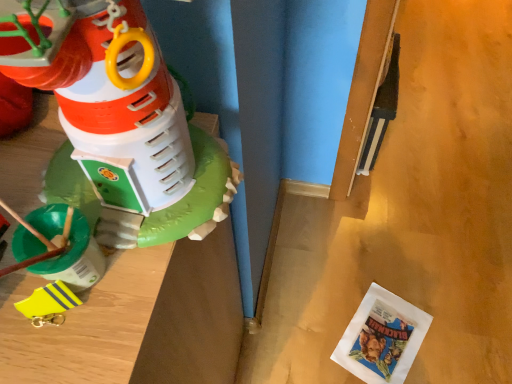
Question: Can you confirm if yellow rubber boot at left, which appears as the 1th toy when viewed from the back, is bigger than white paper comic book at lower right?

Choices:
 (A) no
 (B) yes

Answer: (A)

Question: Is yellow rubber boot at left, which appears as the 1th toy when viewed from the back, shorter than white paper comic book at lower right?

Choices:
 (A) no
 (B) yes

Answer: (A)

Question: Would you consider yellow rubber boot at left, the 2th toy when ordered from front to back, to be distant from white paper comic book at lower right?

Choices:
 (A) no
 (B) yes

Answer: (B)

Question: Considering the relative positions of yellow rubber boot at left, positioned as the second toy in top-to-bottom order, and white paper comic book at lower right in the image provided, is yellow rubber boot at left, positioned as the second toy in top-to-bottom order, behind white paper comic book at lower right?

Choices:
 (A) no
 (B) yes

Answer: (A)

Question: Is yellow rubber boot at left, which appears as the 1th toy when viewed from the back, looking in the opposite direction of white paper comic book at lower right?

Choices:
 (A) no
 (B) yes

Answer: (A)

Question: Is point (424, 312) positioned closer to the camera than point (58, 319)?

Choices:
 (A) closer
 (B) farther

Answer: (B)

Question: In the image, is white paper comic book at lower right positioned in front of or behind yellow rubber boot at left, marked as the 1th toy in a bottom-to-top arrangement?

Choices:
 (A) front
 (B) behind

Answer: (B)

Question: Considering the positions of white paper comic book at lower right and yellow rubber boot at left, marked as the 1th toy in a bottom-to-top arrangement, in the image, is white paper comic book at lower right taller or shorter than yellow rubber boot at left, marked as the 1th toy in a bottom-to-top arrangement,?

Choices:
 (A) tall
 (B) short

Answer: (B)

Question: From a real-world perspective, is white paper comic book at lower right positioned above or below yellow rubber boot at left, marked as the 1th toy in a bottom-to-top arrangement?

Choices:
 (A) below
 (B) above

Answer: (A)

Question: Is yellow rubber boot at left, marked as the 1th toy in a bottom-to-top arrangement, inside the boundaries of white paper comic book at lower right, or outside?

Choices:
 (A) outside
 (B) inside

Answer: (A)

Question: Considering the positions of yellow rubber boot at left, which appears as the 1th toy when viewed from the back, and white paper comic book at lower right in the image, is yellow rubber boot at left, which appears as the 1th toy when viewed from the back, wider or thinner than white paper comic book at lower right?

Choices:
 (A) wide
 (B) thin

Answer: (B)

Question: Is point (66, 304) closer or farther from the camera than point (367, 324)?

Choices:
 (A) closer
 (B) farther

Answer: (A)

Question: In the image, is yellow rubber boot at left, positioned as the second toy in top-to-bottom order, on the left side or the right side of white paper comic book at lower right?

Choices:
 (A) right
 (B) left

Answer: (B)

Question: Is yellow rubber boot at left, the 2th toy when ordered from front to back, taller or shorter than matte plastic toy at left, placed as the 2th toy when sorted from bottom to top?

Choices:
 (A) tall
 (B) short

Answer: (B)

Question: From the image's perspective, is yellow rubber boot at left, the 2th toy when ordered from front to back, located above or below matte plastic toy at left, which appears as the first toy when viewed from the front?

Choices:
 (A) below
 (B) above

Answer: (A)